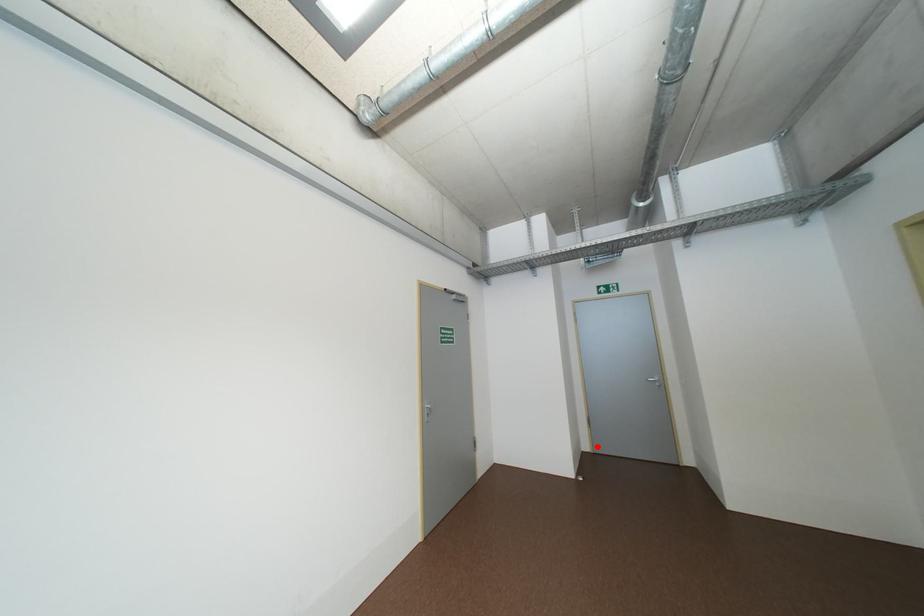
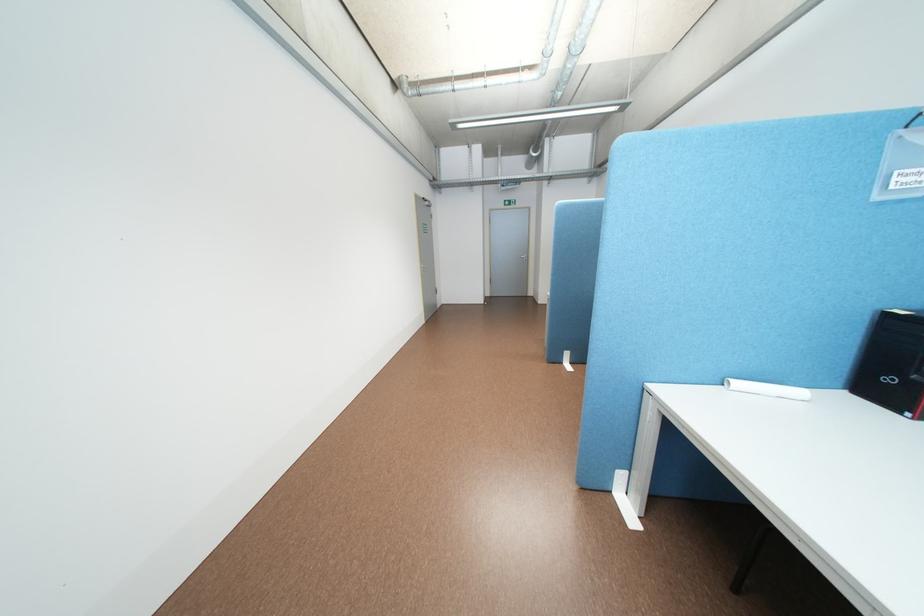
Question: I am providing you with two images of the same scene from different viewpoints. Given a red point in image1, look at the same physical point in image2. Is it:

Choices:
 (A) Closer to the viewpoint
 (B) Farther from the viewpoint

Answer: (A)